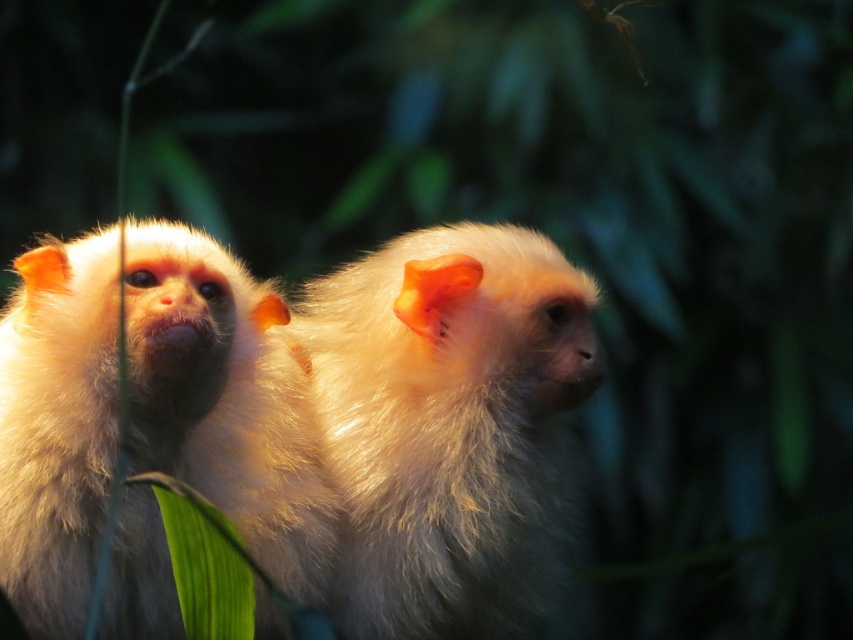
You are a wildlife photographer aiming to capture a closeup shot of the white fluffy monkey at center. Based on the coordinates provided in the description, where should you position your camera to ensure the monkey is centered in your frame?

The white fluffy monkey at center is located at point (225, 400), so you should position your camera to center your frame at those coordinates to capture the monkey.

You are a photographer trying to capture a closeup shot of the monkeys in the image. You notice two points of interest marked as point 1 at coordinates point (138, 550) and point 2 at coordinates point (434, 288). Which point should you focus on to ensure the closest monkey is in sharp focus?

Point (138, 550) is closer to the viewer than point (434, 288), so you should focus on point (138, 550) to ensure the closest monkey is in sharp focus.